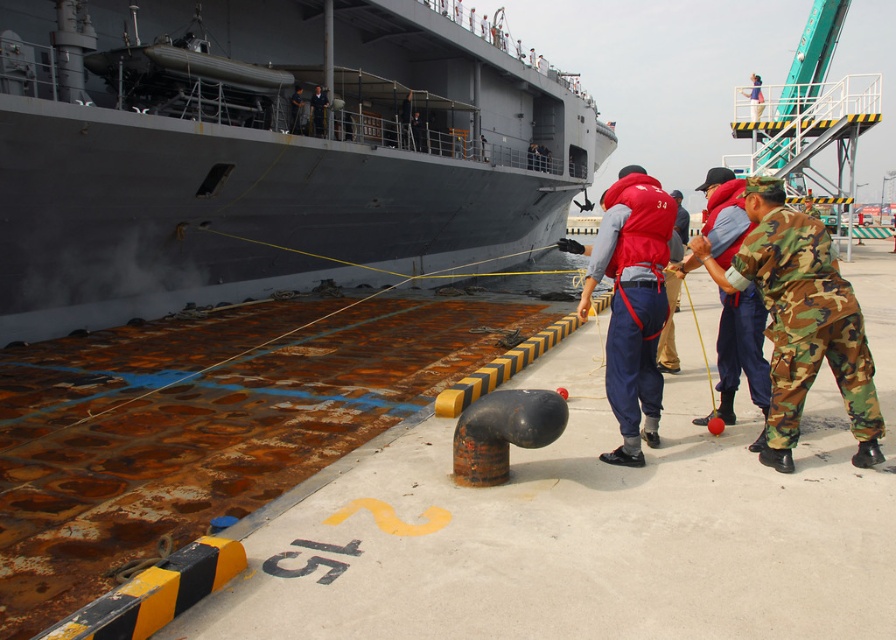
You are a dock worker assessing the space between the gray matte ship at upper left and the red fabric life vest at center. Can you determine if the ship is wider than the life vest?

The gray matte ship at upper left might be wider than the red fabric life vest at center according to the description.

You are a dock worker trying to secure the gray matte ship at upper left and the camo fabric soldier at lower right. Since you have a limited amount of rope, which object requires a longer rope to fully encircle it?

The gray matte ship at upper left requires a longer rope to fully encircle it because its width is larger than the camo fabric soldier at lower right.

You are standing on the dock and see the camo fabric soldier at lower right and the red fabric life vest at center. Which object is closer to the ground?

The camo fabric soldier at lower right is below red fabric life vest at center, so the camo fabric soldier at lower right is closer to the ground.